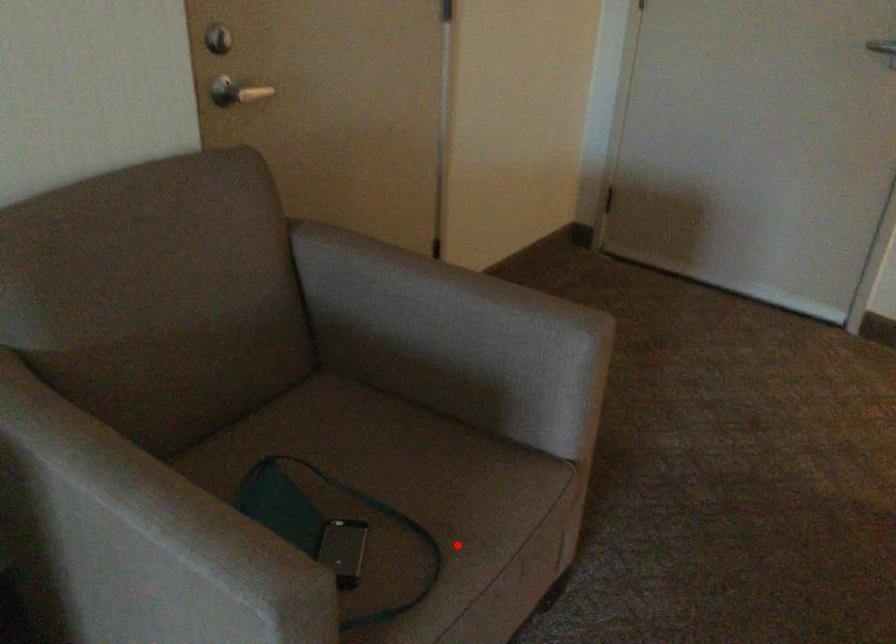
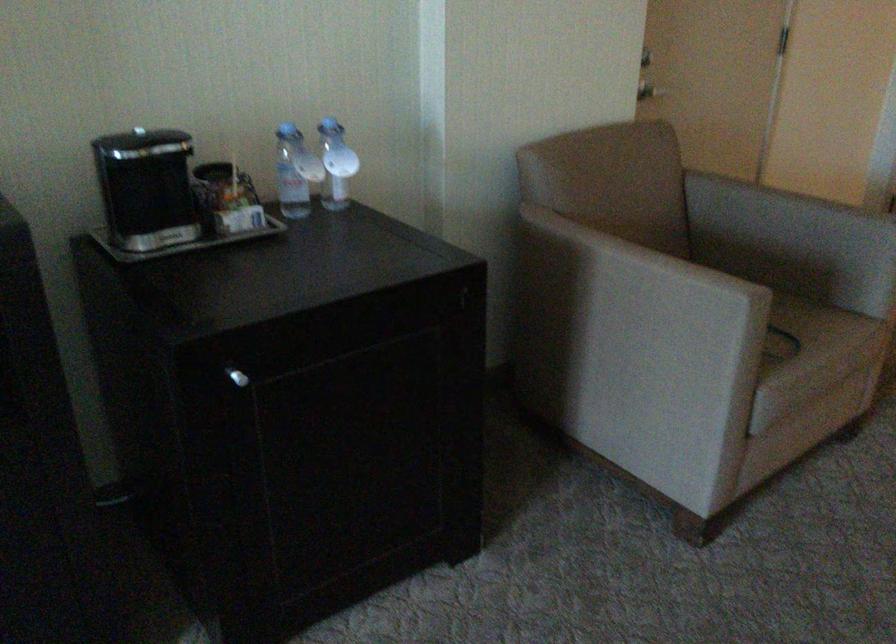
The point at the highlighted location is marked in the first image. Where is the corresponding point in the second image?

(811, 335)